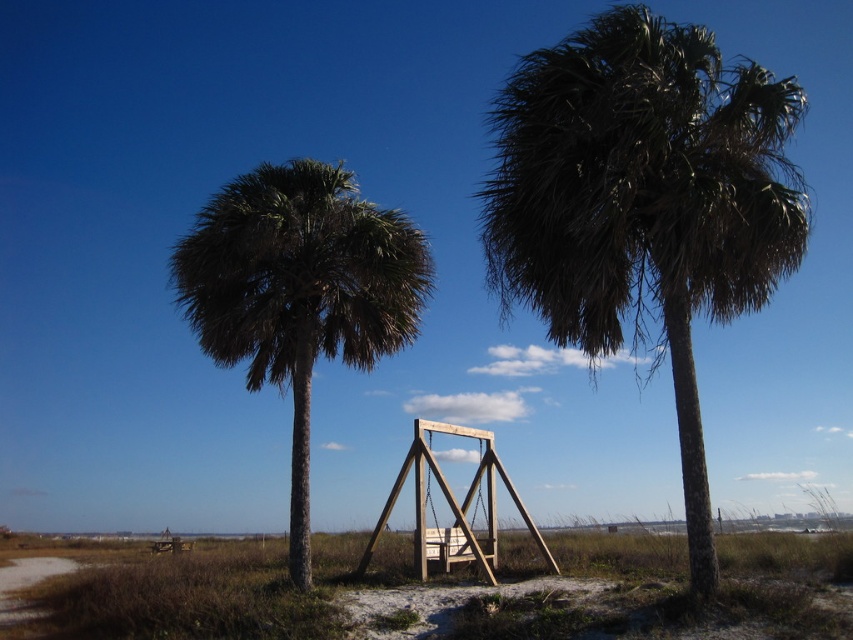
Question: Does dark green leafy palm at center appear on the right side of green leafy palm tree at center?

Choices:
 (A) yes
 (B) no

Answer: (A)

Question: Does dark green leafy palm at center have a smaller size compared to green leafy palm tree at center?

Choices:
 (A) no
 (B) yes

Answer: (A)

Question: Does dark green leafy palm at center come in front of green leafy palm tree at center?

Choices:
 (A) no
 (B) yes

Answer: (B)

Question: Which of the following is the closest to the observer?

Choices:
 (A) (410, 323)
 (B) (525, 141)

Answer: (B)